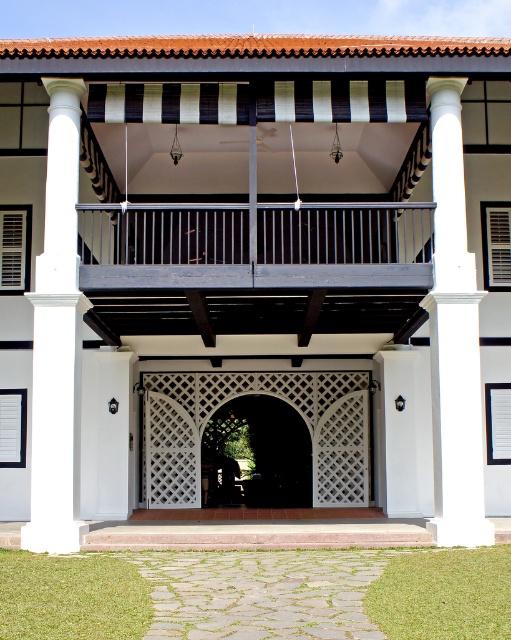
You are an architect designing a new building inspired by this colonial style. You need to ensure that the white smooth column at left aligns proportionally with the dark wood lattice door at center. Based on their sizes, which object should be placed lower to maintain visual balance?

The white smooth column at left is shorter than the dark wood lattice door at center, so to maintain visual balance, the column should be placed lower than the door.